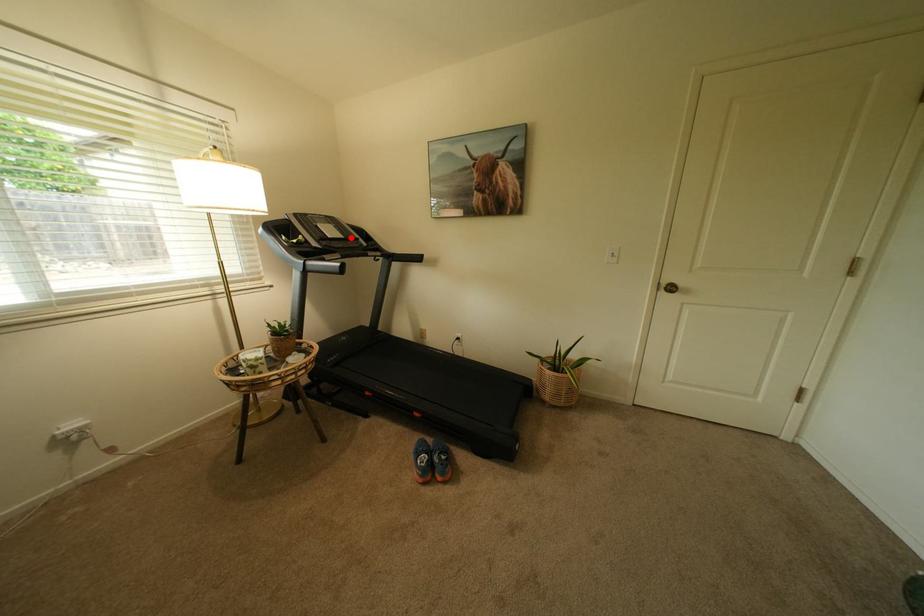
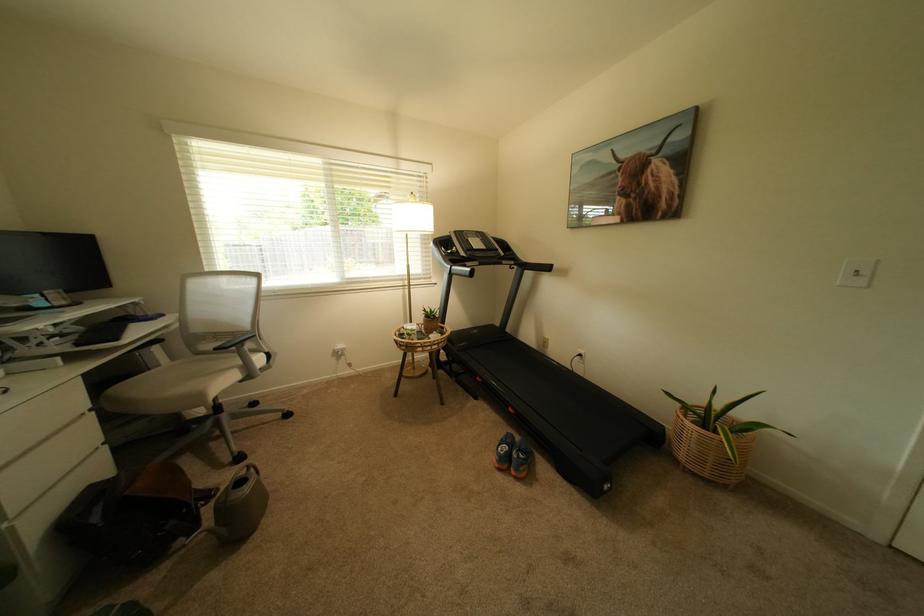
Where in the second image is the point corresponding to the highlighted location from the first image?

(493, 249)